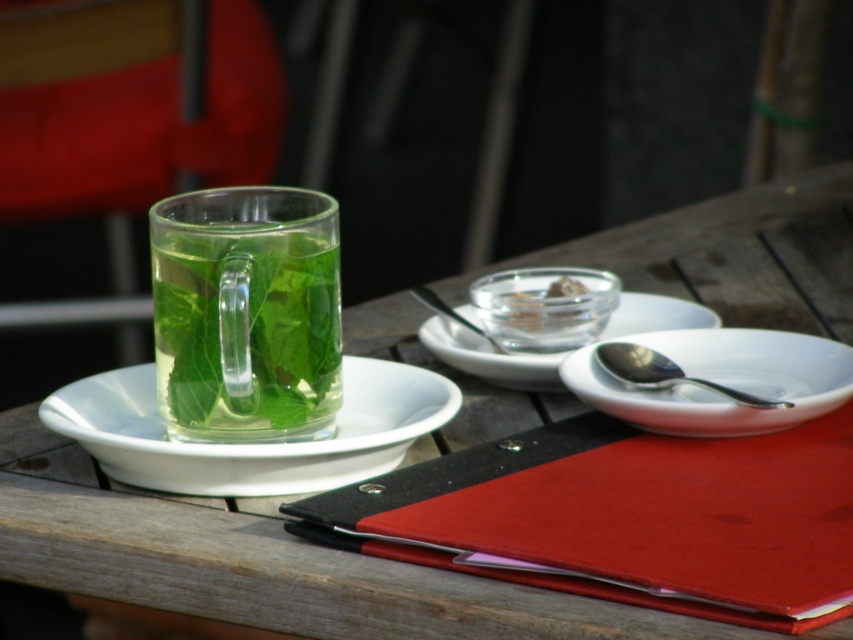
You are a barista trying to stack the transparent glass mug at left and the white ceramic plate at upper left vertically in a cabinet. Which one should you place at the bottom to prevent the stack from toppling over?

You should place the transparent glass mug at left at the bottom since it is taller than the white ceramic plate at upper left, providing a stable base for the stack.

You are at a cafe table and want to reach for the sugar cubes. You see a white ceramic plate at upper left and a white ceramic plate at center. Which plate is closer to your left hand?

The white ceramic plate at upper left is closer to your left hand because it is positioned to the left of the white ceramic plate at center.

You are setting up a small tray for a customer. The tray can only hold items that are smaller than 10 cm in diameter. You have the transparent glass mug at left and the white ceramic plate at upper left. Which item can fit on the tray?

The transparent glass mug at left can fit on the tray since it is smaller than the white ceramic plate at upper left, and assuming the plate exceeds the 10 cm diameter limit, the mug likely meets the size requirement.